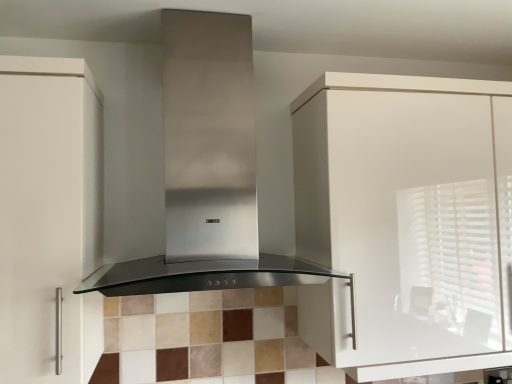
Locate an element on the screen. white matte cabinet at left, the second cabinetry viewed from the right is located at coordinates (49, 217).

Locate an element on the screen. This screenshot has height=384, width=512. white glossy cabinet at upper right, the 1th cabinetry from the right is located at coordinates (405, 221).

Find the location of `stainless steel range hood at center`. stainless steel range hood at center is located at coordinates (208, 170).

Considering the sizes of objects white matte cabinet at left, the 1th cabinetry viewed from the left, and stainless steel range hood at center in the image provided, who is taller, white matte cabinet at left, the 1th cabinetry viewed from the left, or stainless steel range hood at center?

white matte cabinet at left, the 1th cabinetry viewed from the left, is taller.

Is white matte cabinet at left, the 1th cabinetry viewed from the left, to the left or to the right of stainless steel range hood at center in the image?

Clearly, white matte cabinet at left, the 1th cabinetry viewed from the left, is on the left of stainless steel range hood at center in the image.

Could you tell me if white matte cabinet at left, the 1th cabinetry viewed from the left, is facing stainless steel range hood at center?

No.

Does stainless steel range hood at center have a smaller size compared to white glossy cabinet at upper right, the 1th cabinetry from the right?

Yes, stainless steel range hood at center is smaller than white glossy cabinet at upper right, the 1th cabinetry from the right.

What's the angular difference between stainless steel range hood at center and white glossy cabinet at upper right, which is the 2th cabinetry in left-to-right order,'s facing directions?

stainless steel range hood at center and white glossy cabinet at upper right, which is the 2th cabinetry in left-to-right order, are facing 1.67 degrees away from each other.

Between stainless steel range hood at center and white glossy cabinet at upper right, the 1th cabinetry from the right, which one has less height?

Standing shorter between the two is stainless steel range hood at center.

From a real-world perspective, is stainless steel range hood at center located beneath white glossy cabinet at upper right, which is the 2th cabinetry in left-to-right order?

Incorrect, from a real-world perspective, stainless steel range hood at center is higher than white glossy cabinet at upper right, which is the 2th cabinetry in left-to-right order.

Between white matte cabinet at left, the 1th cabinetry viewed from the left, and white glossy cabinet at upper right, the 1th cabinetry from the right, which one has larger width?

Wider between the two is white matte cabinet at left, the 1th cabinetry viewed from the left.

Can you confirm if white matte cabinet at left, the 1th cabinetry viewed from the left, is shorter than white glossy cabinet at upper right, which is the 2th cabinetry in left-to-right order?

Incorrect, the height of white matte cabinet at left, the 1th cabinetry viewed from the left, does not fall short of that of white glossy cabinet at upper right, which is the 2th cabinetry in left-to-right order.

How different are the orientations of white matte cabinet at left, the second cabinetry viewed from the right, and white glossy cabinet at upper right, the 1th cabinetry from the right, in degrees?

The angle between the facing direction of white matte cabinet at left, the second cabinetry viewed from the right, and the facing direction of white glossy cabinet at upper right, the 1th cabinetry from the right, is 0.639 degrees.

Is white matte cabinet at left, the 1th cabinetry viewed from the left, in front of or behind white glossy cabinet at upper right, which is the 2th cabinetry in left-to-right order, in the image?

white matte cabinet at left, the 1th cabinetry viewed from the left, is in front of white glossy cabinet at upper right, which is the 2th cabinetry in left-to-right order.

Consider the image. Considering the sizes of objects white glossy cabinet at upper right, the 1th cabinetry from the right, and white matte cabinet at left, the 1th cabinetry viewed from the left, in the image provided, who is wider, white glossy cabinet at upper right, the 1th cabinetry from the right, or white matte cabinet at left, the 1th cabinetry viewed from the left,?

Wider between the two is white matte cabinet at left, the 1th cabinetry viewed from the left.

Is white glossy cabinet at upper right, which is the 2th cabinetry in left-to-right order, oriented towards white matte cabinet at left, the second cabinetry viewed from the right?

No, white glossy cabinet at upper right, which is the 2th cabinetry in left-to-right order, is not facing towards white matte cabinet at left, the second cabinetry viewed from the right.

From the image's perspective, which one is positioned lower, white glossy cabinet at upper right, which is the 2th cabinetry in left-to-right order, or white matte cabinet at left, the second cabinetry viewed from the right?

From the image's view, white matte cabinet at left, the second cabinetry viewed from the right, is below.

Is white matte cabinet at left, the second cabinetry viewed from the right, located within white glossy cabinet at upper right, which is the 2th cabinetry in left-to-right order?

No, white glossy cabinet at upper right, which is the 2th cabinetry in left-to-right order, does not contain white matte cabinet at left, the second cabinetry viewed from the right.

Can stainless steel range hood at center be found inside white glossy cabinet at upper right, which is the 2th cabinetry in left-to-right order?

Actually, stainless steel range hood at center is outside white glossy cabinet at upper right, which is the 2th cabinetry in left-to-right order.

Between white glossy cabinet at upper right, the 1th cabinetry from the right, and stainless steel range hood at center, which one has more height?

white glossy cabinet at upper right, the 1th cabinetry from the right.

Considering the positions of point (496, 140) and point (208, 141), is point (496, 140) closer or farther from the camera than point (208, 141)?

Point (496, 140) is positioned farther from the camera compared to point (208, 141).

Identify the location of cabinetry located on the right of stainless steel range hood at center. The height and width of the screenshot is (384, 512). click(405, 221).

Which object is further away from the camera taking this photo, stainless steel range hood at center or white matte cabinet at left, the 1th cabinetry viewed from the left?

Positioned behind is white matte cabinet at left, the 1th cabinetry viewed from the left.

From a real-world perspective, is stainless steel range hood at center positioned under white matte cabinet at left, the 1th cabinetry viewed from the left, based on gravity?

No.

Which object is positioned more to the left, stainless steel range hood at center or white matte cabinet at left, the second cabinetry viewed from the right?

From the viewer's perspective, white matte cabinet at left, the second cabinetry viewed from the right, appears more on the left side.

From the image's perspective, which cabinetry is the 2nd one below the stainless steel range hood at center? Please provide its 2D coordinates.

[(49, 217)]

Which cabinetry is the 2nd one when counting from the back of the stainless steel range hood at center? Please provide its 2D coordinates.

[(405, 221)]

Based on the photo, which object lies further to the anchor point stainless steel range hood at center, white matte cabinet at left, the 1th cabinetry viewed from the left, or white glossy cabinet at upper right, which is the 2th cabinetry in left-to-right order?

white glossy cabinet at upper right, which is the 2th cabinetry in left-to-right order.

Looking at this image, which object lies nearer to the anchor point white matte cabinet at left, the second cabinetry viewed from the right, stainless steel range hood at center or white glossy cabinet at upper right, which is the 2th cabinetry in left-to-right order?

stainless steel range hood at center is positioned closer to the anchor white matte cabinet at left, the second cabinetry viewed from the right.

Estimate the real-world distances between objects in this image. Which object is closer to stainless steel range hood at center, white glossy cabinet at upper right, the 1th cabinetry from the right, or white matte cabinet at left, the 1th cabinetry viewed from the left?

white matte cabinet at left, the 1th cabinetry viewed from the left, is positioned closer to the anchor stainless steel range hood at center.

Considering their positions, is white matte cabinet at left, the second cabinetry viewed from the right, positioned further to white glossy cabinet at upper right, which is the 2th cabinetry in left-to-right order, than stainless steel range hood at center?

The object further to white glossy cabinet at upper right, which is the 2th cabinetry in left-to-right order, is white matte cabinet at left, the second cabinetry viewed from the right.

Which object lies further to the anchor point white matte cabinet at left, the 1th cabinetry viewed from the left, white glossy cabinet at upper right, the 1th cabinetry from the right, or stainless steel range hood at center?

Based on the image, white glossy cabinet at upper right, the 1th cabinetry from the right, appears to be further to white matte cabinet at left, the 1th cabinetry viewed from the left.

Looking at this image, estimate the real-world distances between objects in this image. Which object is closer to white glossy cabinet at upper right, which is the 2th cabinetry in left-to-right order, stainless steel range hood at center or white matte cabinet at left, the second cabinetry viewed from the right?

Based on the image, stainless steel range hood at center appears to be nearer to white glossy cabinet at upper right, which is the 2th cabinetry in left-to-right order.

Find the location of a particular element. This screenshot has width=512, height=384. home appliance between white matte cabinet at left, the second cabinetry viewed from the right, and white glossy cabinet at upper right, which is the 2th cabinetry in left-to-right order, in the horizontal direction is located at coordinates (208, 170).